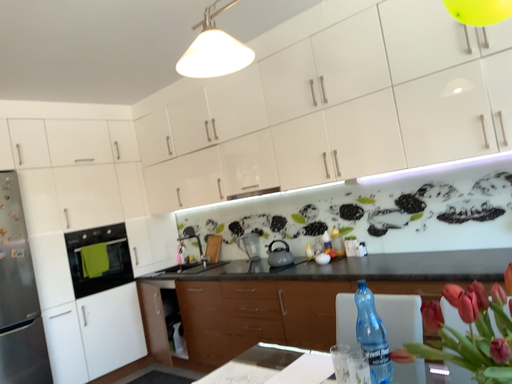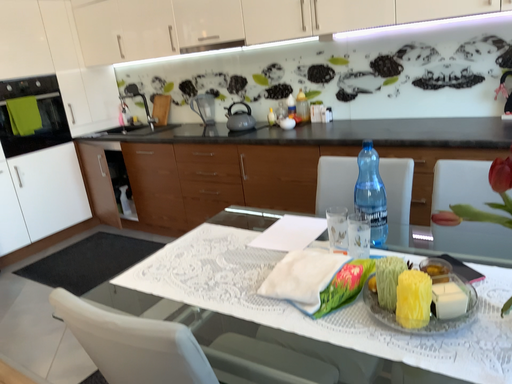
Question: How did the camera likely rotate when shooting the video?

Choices:
 (A) rotated upward
 (B) rotated downward

Answer: (B)